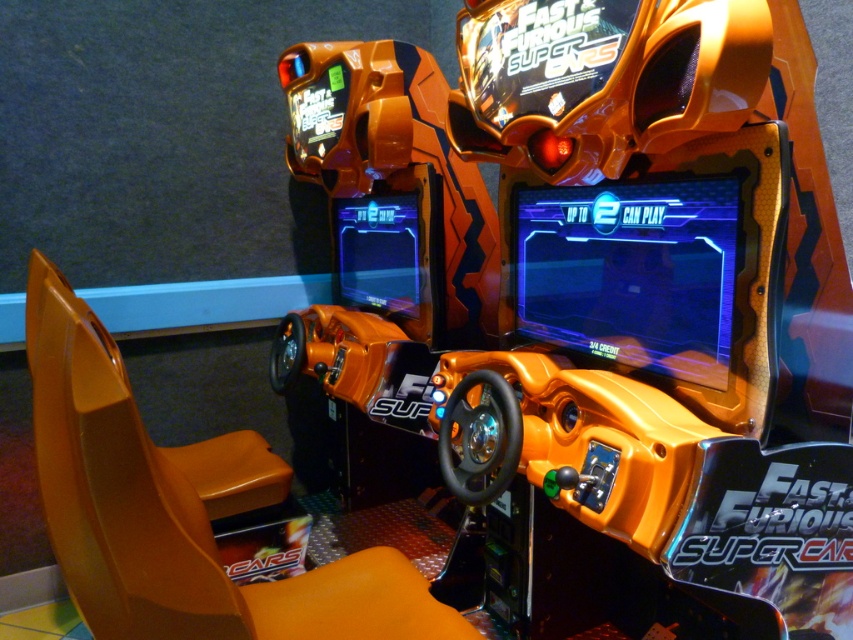
Question: Is orange matte/soft plastic arcade game at center bigger than shiny orange arcade machine at center?

Choices:
 (A) no
 (B) yes

Answer: (B)

Question: From the image, what is the correct spatial relationship of orange matte/soft plastic arcade game at center in relation to shiny orange arcade machine at center?

Choices:
 (A) above
 (B) below

Answer: (A)

Question: Which point is closer to the camera taking this photo?

Choices:
 (A) (610, 337)
 (B) (747, 109)

Answer: (B)

Question: Is orange matte/soft plastic arcade game at center thinner than shiny orange arcade machine at center?

Choices:
 (A) yes
 (B) no

Answer: (B)